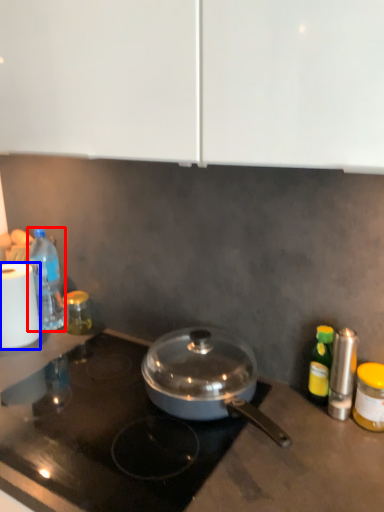
Question: Among these objects, which one is farthest to the camera, bottle (highlighted by a red box) or paper towel (highlighted by a blue box)?

Choices:
 (A) bottle
 (B) paper towel

Answer: (A)